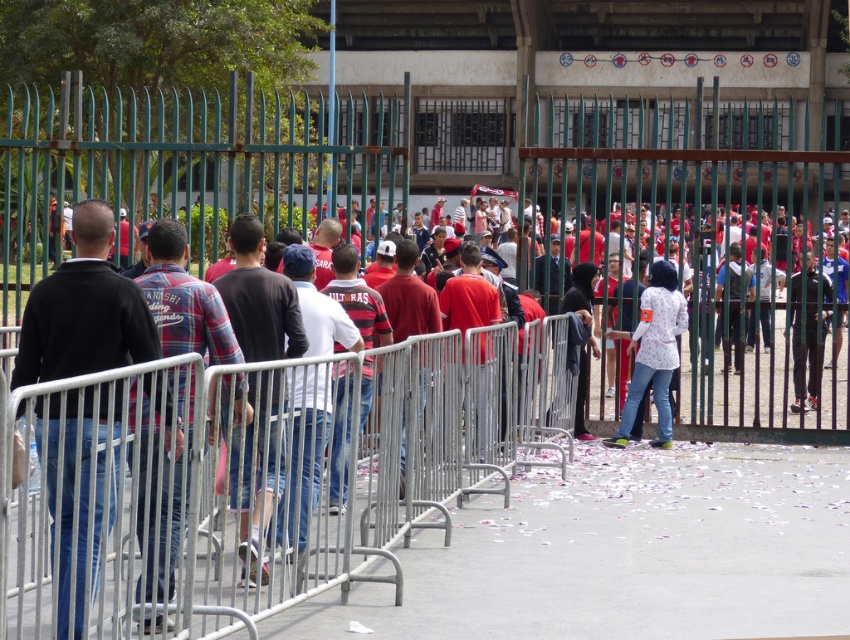
You are an event organizer trying to arrange two shirts for a photo op. The black sweater at left and the white matte shirt at center are available. Which shirt has a narrower width?

The black sweater at left is thinner than the white matte shirt at center, so the black sweater at left has a narrower width.

Looking at this image, you are a photographer positioned at the front of the crowd. You want to capture a photo of the plaid shirt at center and dark blue jeans at center. Which one should you adjust your camera focus to first if you want to ensure both are in frame?

The plaid shirt at center is to the left of dark blue jeans at center. Since the photographer is at the front, adjusting focus on the plaid shirt at center first would allow the dark blue jeans at center to naturally fall into the frame as you pan right.

You are a photographer trying to capture a candid shot of the plaid shirt at center and dark blue jeans at center. Your camera has a minimum focus distance of 20 inches. Can you focus on both subjects without moving your position?

The plaid shirt at center is 20.11 inches away from dark blue jeans at center. Since the distance between them is slightly over 20 inches, the camera can focus on both subjects as they are within the minimum focus distance requirement.